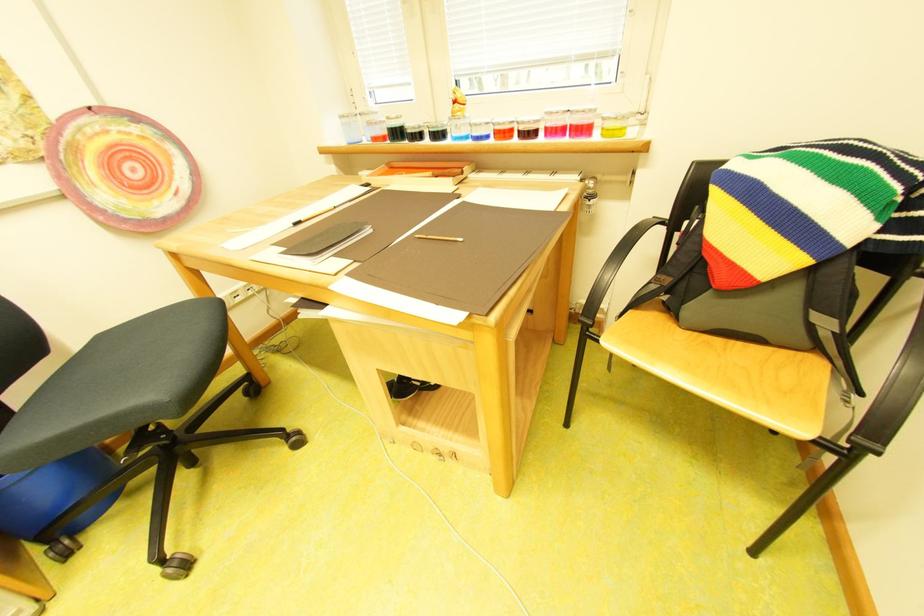
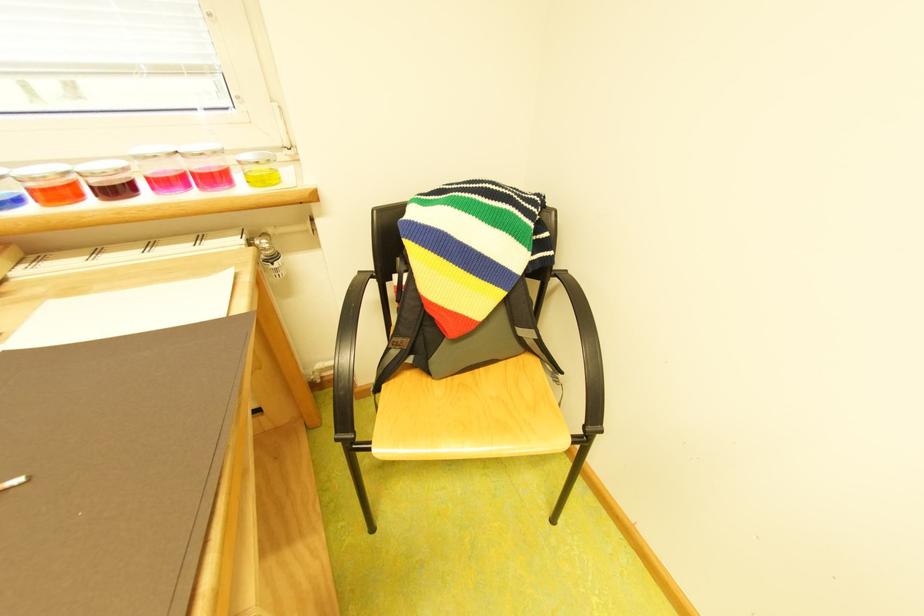
Locate, in the second image, the point that corresponds to [601,190] in the first image.

(275, 251)